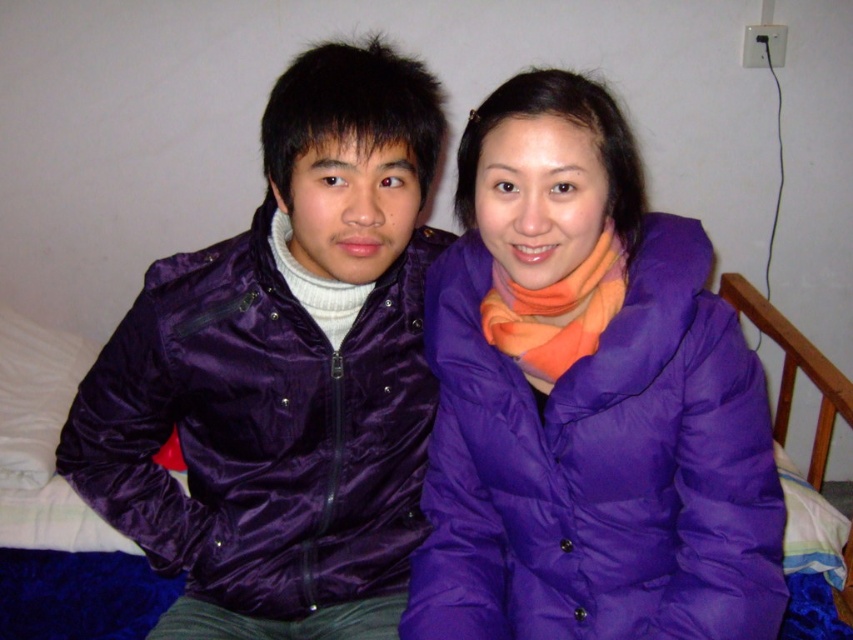
You are trying to decide which purple jacket to take for a walk. Both are in the image. The purple down jacket at right and the satin purple jacket at left. Which one is positioned to the right side of the other?

The purple down jacket at right is positioned to the right of the satin purple jacket at left.

You are trying to decide which purple jacket to wear for a cold day. Both the purple down jacket at right and the satin purple jacket at left are options. Based on their sizes, which one might be more suitable for layering under a coat?

The purple down jacket at right has a lesser width compared to the satin purple jacket at left, so it might be more suitable for layering under a coat since it is narrower and less bulky.